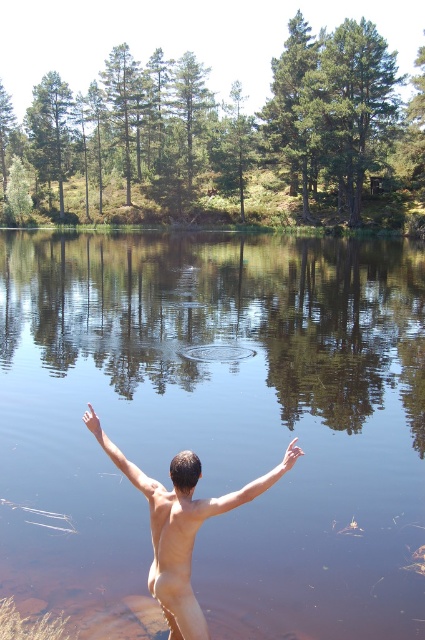
You are a photographer positioned at the edge of the water. You want to capture a photo that includes both the point at the edge of the water and the point further away in the background. Which of the two points, point (164, 611) or point (280, 467), is closer to your camera?

Point (164, 611) is closer to the camera than point (280, 467) because it is further to the camera than the other point.

From the picture: You are a photographer trying to capture the perfect shot of the skinny nude man at center and the skinny tan arm at center. Based on their sizes, which one should you zoom in on to ensure it appears larger in your photo?

The skinny nude man at center is taller than the skinny tan arm at center, so zooming in on the skinny nude man at center will make it appear larger in the photo.

You are a photographer trying to capture the reflection of the skinny tan arm at center and the skinny flesh at upper center in the water. Which object will appear higher in the reflection?

The skinny flesh at upper center will appear higher in the reflection because it is positioned above the skinny tan arm at center.